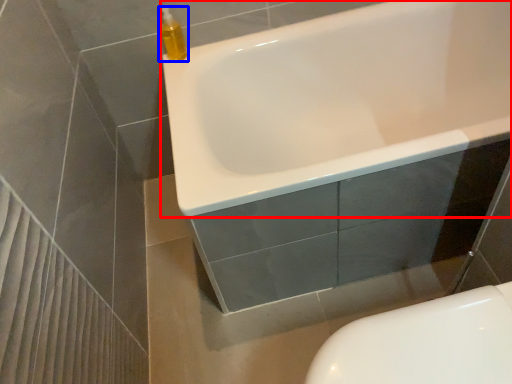
Question: Which object is further to the camera taking this photo, bathtub (highlighted by a red box) or cleaning product (highlighted by a blue box)?

Choices:
 (A) bathtub
 (B) cleaning product

Answer: (B)